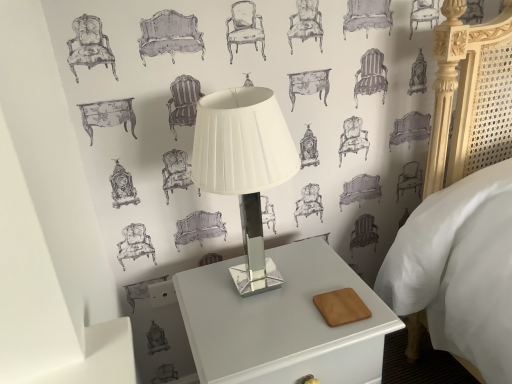
What is the approximate height of white glossy table lamp at center?

19.16 inches.

What do you see at coordinates (244, 166) in the screenshot? The image size is (512, 384). I see `white glossy table lamp at center` at bounding box center [244, 166].

The image size is (512, 384). I want to click on white glossy table lamp at center, so click(x=244, y=166).

Measure the distance between white glossy table lamp at center and camera.

They are 32.39 inches apart.

Measure the distance between point (x=232, y=370) and camera.

Point (x=232, y=370) and camera are 33.15 inches apart from each other.

The height and width of the screenshot is (384, 512). Identify the location of white glossy nightstand at center. (282, 322).

Image resolution: width=512 pixels, height=384 pixels. Describe the element at coordinates (282, 322) in the screenshot. I see `white glossy nightstand at center` at that location.

At what (x,y) coordinates should I click in order to perform the action: click on white glossy table lamp at center. Please return your answer as a coordinate pair (x, y). The height and width of the screenshot is (384, 512). Looking at the image, I should click on (244, 166).

Considering the positions of objects white glossy nightstand at center and white glossy table lamp at center in the image provided, who is more to the right, white glossy nightstand at center or white glossy table lamp at center?

From the viewer's perspective, white glossy nightstand at center appears more on the right side.

Considering their positions, is white glossy nightstand at center located in front of or behind white glossy table lamp at center?

white glossy nightstand at center is positioned farther from the viewer than white glossy table lamp at center.

Which is less distant, (207, 359) or (248, 292)?

Point (207, 359) appears to be closer to the viewer than point (248, 292).

From the image's perspective, is white glossy nightstand at center on top of white glossy table lamp at center?

No.

From the picture: From a real-world perspective, between white glossy nightstand at center and white glossy table lamp at center, who is vertically higher?

white glossy table lamp at center.

In terms of width, does white glossy nightstand at center look wider or thinner when compared to white glossy table lamp at center?

Considering their sizes, white glossy nightstand at center looks broader than white glossy table lamp at center.

Does white glossy nightstand at center have a greater height compared to white glossy table lamp at center?

Yes.

Which of these two, white glossy nightstand at center or white glossy table lamp at center, is bigger?

Bigger between the two is white glossy nightstand at center.

Is white glossy nightstand at center outside of white glossy table lamp at center?

Yes, white glossy nightstand at center is not within white glossy table lamp at center.

Is the surface of white glossy nightstand at center in direct contact with white glossy table lamp at center?

No.

Is white glossy nightstand at center positioned with its back to white glossy table lamp at center?

No, white glossy nightstand at center is not facing the opposite direction of white glossy table lamp at center.

How different are the orientations of white glossy nightstand at center and white glossy table lamp at center in degrees?

1.54 degrees separate the facing orientations of white glossy nightstand at center and white glossy table lamp at center.

From the picture: Measure the distance between white glossy nightstand at center and white glossy table lamp at center.

The distance of white glossy nightstand at center from white glossy table lamp at center is 13.90 inches.

Identify the location of lamp in front of the white glossy nightstand at center. This screenshot has height=384, width=512. (244, 166).

Considering the positions of objects white glossy table lamp at center and white glossy nightstand at center in the image provided, who is more to the left, white glossy table lamp at center or white glossy nightstand at center?

From the viewer's perspective, white glossy table lamp at center appears more on the left side.

Is the depth of white glossy table lamp at center less than that of white glossy nightstand at center?

Yes, white glossy table lamp at center is closer to the viewer.

Does point (258, 198) lie in front of point (209, 325)?

No.

From the image's perspective, is white glossy table lamp at center beneath white glossy nightstand at center?

No, from the image's perspective, white glossy table lamp at center is not below white glossy nightstand at center.

From a real-world perspective, relative to white glossy nightstand at center, is white glossy table lamp at center vertically above or below?

From a real-world perspective, white glossy table lamp at center is physically above white glossy nightstand at center.

Between white glossy table lamp at center and white glossy nightstand at center, which one has smaller width?

white glossy table lamp at center is thinner.

Which of these two, white glossy table lamp at center or white glossy nightstand at center, stands taller?

Standing taller between the two is white glossy nightstand at center.

Which of these two, white glossy table lamp at center or white glossy nightstand at center, is smaller?

Smaller between the two is white glossy table lamp at center.

Can we say white glossy table lamp at center lies outside white glossy nightstand at center?

That's correct, white glossy table lamp at center is outside of white glossy nightstand at center.

Are white glossy table lamp at center and white glossy nightstand at center far apart?

white glossy table lamp at center is near white glossy nightstand at center, not far away.

Is white glossy table lamp at center oriented towards white glossy nightstand at center?

No, white glossy table lamp at center is not aimed at white glossy nightstand at center.

This screenshot has width=512, height=384. In order to click on nightstand located on the right of white glossy table lamp at center in this screenshot , I will do `click(282, 322)`.

There is a white glossy nightstand at center. What are the coordinates of `lamp above it (from a real-world perspective)` in the screenshot? It's located at (244, 166).

Image resolution: width=512 pixels, height=384 pixels. What are the coordinates of `lamp above the white glossy nightstand at center (from the image's perspective)` in the screenshot? It's located at (x=244, y=166).